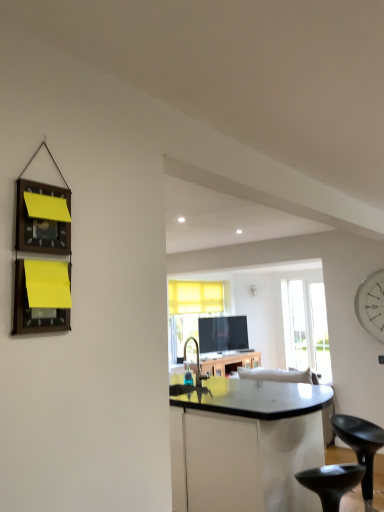
Question: From a real-world perspective, is black plastic stool at lower right, the 2th stool from the right, above or below white glossy clock at right?

Choices:
 (A) above
 (B) below

Answer: (B)

Question: In the image, is black plastic stool at lower right, the 2th stool from the right, positioned in front of or behind white glossy clock at right?

Choices:
 (A) front
 (B) behind

Answer: (A)

Question: Which object is positioned closest to the white glossy clock at right?

Choices:
 (A) translucent glass table at center
 (B) transparent glass door at center
 (C) black plastic stool at lower right, the second stool in the left-to-right sequence
 (D) matte silver faucet at center
 (E) white fabric couch at center

Answer: (E)

Question: Estimate the real-world distances between objects in this image. Which object is closer to the transparent glass door at center?

Choices:
 (A) black plastic stool at lower right, the second stool in the left-to-right sequence
 (B) white fabric couch at center
 (C) wooden frame at left
 (D) white glossy clock at right
 (E) black plastic stool at lower right, which is the 1th stool from left to right

Answer: (D)